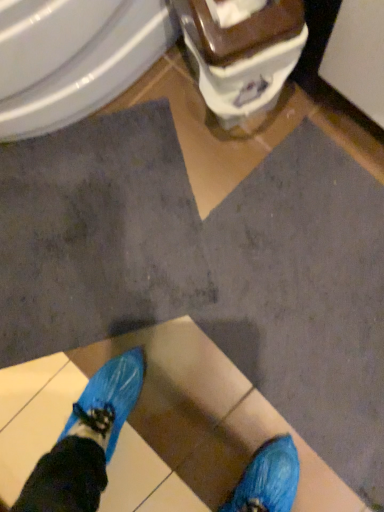
What are the coordinates of `vacant space to the left of brown glossy toilet at upper center` in the screenshot? It's located at (173, 128).